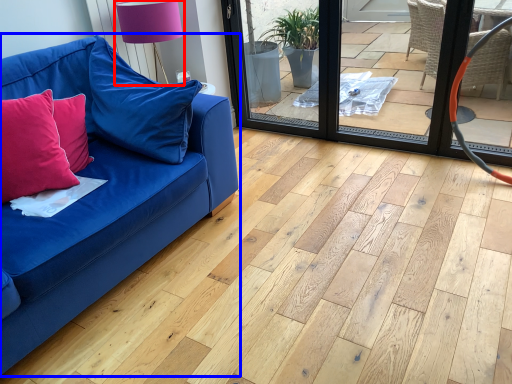
Question: Which of the following is the farthest to the observer, table lamp (highlighted by a red box) or studio couch (highlighted by a blue box)?

Choices:
 (A) table lamp
 (B) studio couch

Answer: (A)